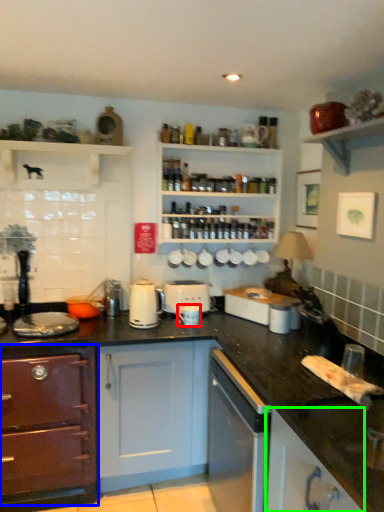
Question: Which object is positioned closest to appliance (highlighted by a red box)? Select from cabinetry (highlighted by a blue box) and cabinetry (highlighted by a green box).

Choices:
 (A) cabinetry
 (B) cabinetry

Answer: (A)